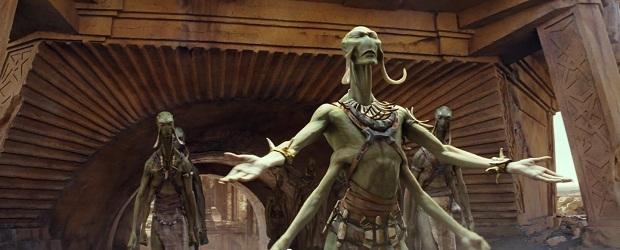
What are the coordinates of `doorway` in the screenshot? It's located at (217, 219).